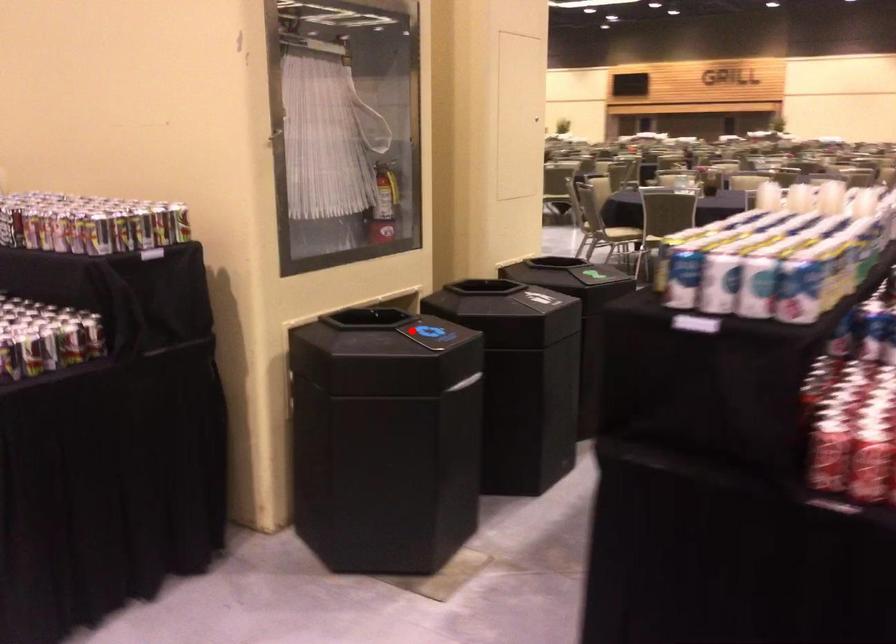
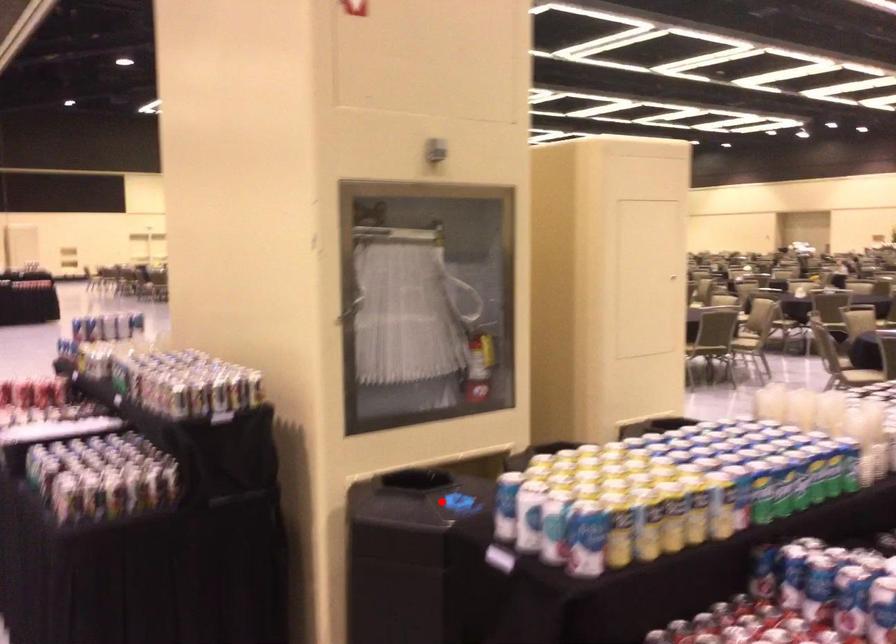
I am providing you with two images of the same scene from different viewpoints. A red point is marked on the first image and another point is marked on the second image. Is the marked point in image1 the same physical position as the marked point in image2?

Yes